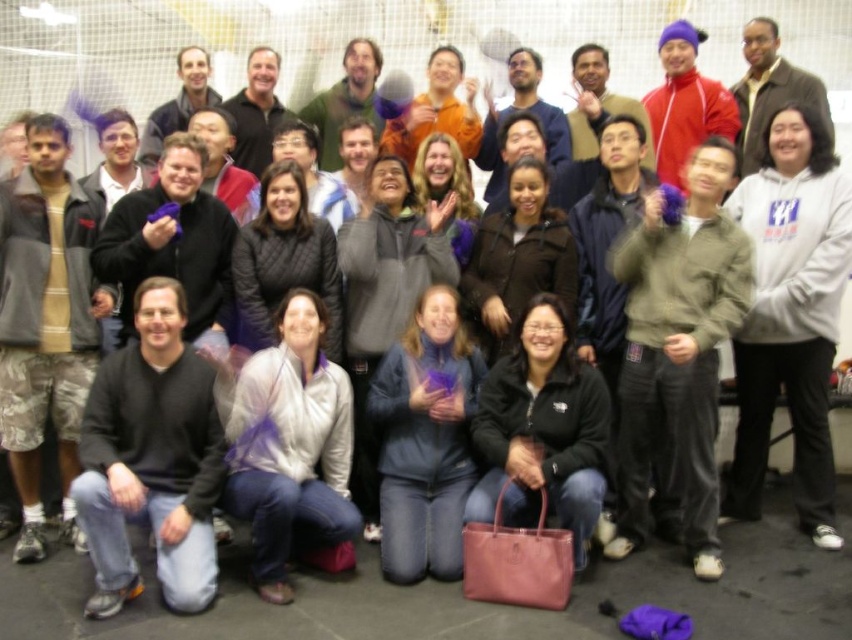
Question: Estimate the real-world distances between objects in this image. Which object is closer to the matte gray jacket at center?

Choices:
 (A) white fleece hoodie at right
 (B) black matte jacket at lower center

Answer: (A)

Question: Can you confirm if matte gray jacket at center is smaller than black matte jacket at lower center?

Choices:
 (A) no
 (B) yes

Answer: (A)

Question: Is the position of matte gray jacket at center less distant than that of black matte jacket at lower center?

Choices:
 (A) no
 (B) yes

Answer: (A)

Question: Which object appears farthest from the camera in this image?

Choices:
 (A) black matte jacket at lower center
 (B) white fleece hoodie at right

Answer: (B)

Question: Which of the following is the farthest from the observer?

Choices:
 (A) (486, 381)
 (B) (796, 204)

Answer: (B)

Question: Does matte gray jacket at center have a smaller size compared to black matte jacket at lower center?

Choices:
 (A) no
 (B) yes

Answer: (A)